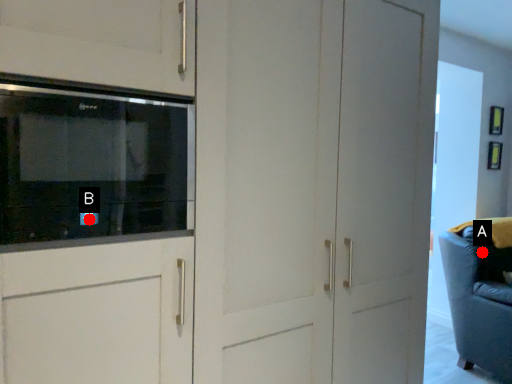
Question: Two points are circled on the image, labeled by A and B beside each circle. Which point is closer to the camera taking this photo?

Choices:
 (A) A is closer
 (B) B is closer

Answer: (B)